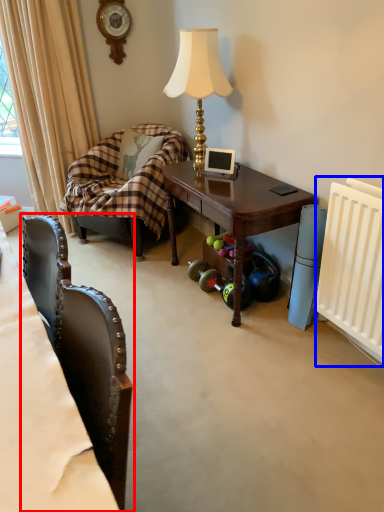
Question: Which object appears closest to the camera in this image, chair (highlighted by a red box) or radiator (highlighted by a blue box)?

Choices:
 (A) chair
 (B) radiator

Answer: (A)